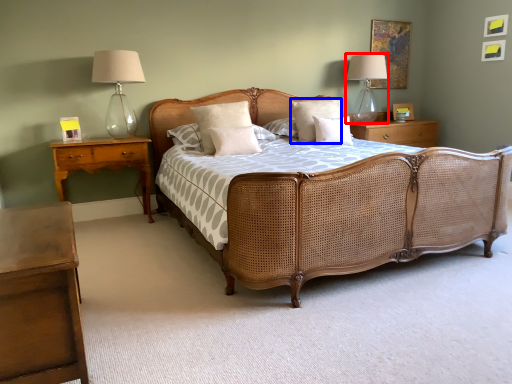
Question: Which point is further to the camera, bedside lamp (highlighted by a red box) or pillow (highlighted by a blue box)?

Choices:
 (A) bedside lamp
 (B) pillow

Answer: (A)